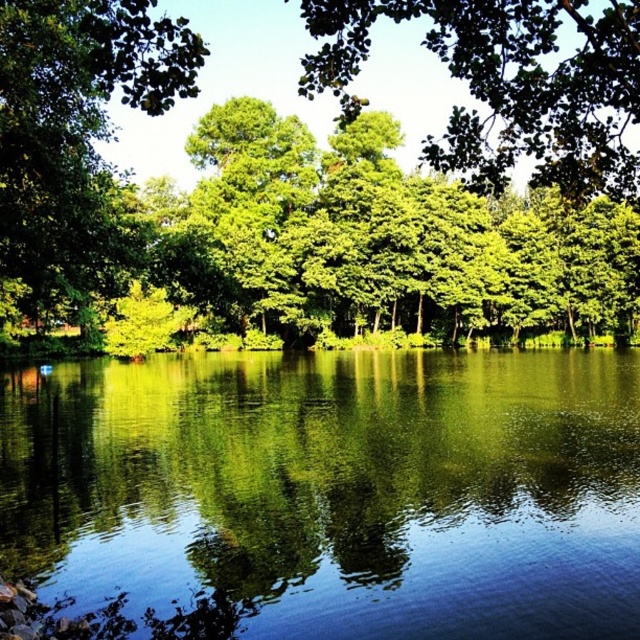
Question: Which of the following is the farthest from the observer?

Choices:
 (A) green leafy tree at left
 (B) green leafy tree at center
 (C) green reflective water at center

Answer: (B)

Question: Is green reflective water at center closer to the viewer compared to green leafy tree at left?

Choices:
 (A) no
 (B) yes

Answer: (B)

Question: Is green leafy tree at center smaller than green leafy tree at left?

Choices:
 (A) yes
 (B) no

Answer: (B)

Question: Which is farther from the green leafy tree at left?

Choices:
 (A) green reflective water at center
 (B) green leafy tree at center

Answer: (B)

Question: Which point is farther to the camera?

Choices:
 (A) (90, 193)
 (B) (588, 422)

Answer: (B)

Question: Where is green leafy tree at center located in relation to green leafy tree at left in the image?

Choices:
 (A) below
 (B) above

Answer: (B)